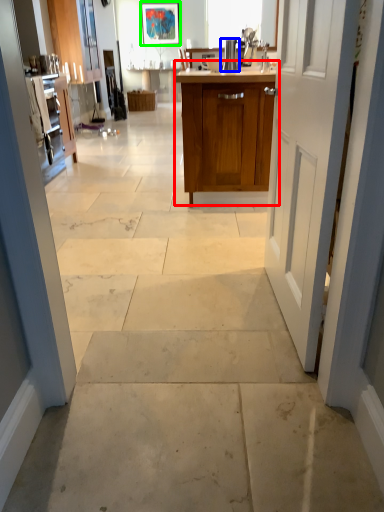
Question: Considering the real-world distances, which object is closest to cabinetry (highlighted by a red box)? appliance (highlighted by a blue box) or picture frame (highlighted by a green box).

Choices:
 (A) appliance
 (B) picture frame

Answer: (A)